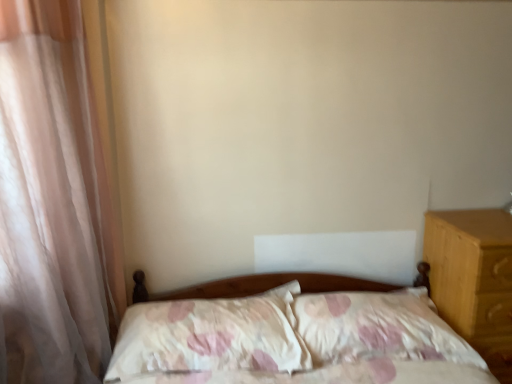
Question: Which direction should I rotate to look at fluffy white pillow at center, which is the 1th pillow in left-to-right order?

Choices:
 (A) right
 (B) left

Answer: (B)

Question: Could you tell me if light brown wood at right is turned towards fluffy white pillow at center, which ranks as the second pillow in right-to-left order?

Choices:
 (A) yes
 (B) no

Answer: (B)

Question: Considering the relative positions of light brown wood at right and fluffy white pillow at center, which is the 1th pillow in left-to-right order, in the image provided, is light brown wood at right to the right of fluffy white pillow at center, which is the 1th pillow in left-to-right order, from the viewer's perspective?

Choices:
 (A) yes
 (B) no

Answer: (A)

Question: Does light brown wood at right have a greater width compared to fluffy white pillow at center, which ranks as the second pillow in right-to-left order?

Choices:
 (A) no
 (B) yes

Answer: (B)

Question: From a real-world perspective, does light brown wood at right stand above fluffy white pillow at center, which is the 1th pillow in left-to-right order?

Choices:
 (A) no
 (B) yes

Answer: (A)

Question: From a real-world perspective, is light brown wood at right physically below fluffy white pillow at center, which ranks as the second pillow in right-to-left order?

Choices:
 (A) yes
 (B) no

Answer: (A)

Question: From the image's perspective, would you say light brown wood at right is shown under fluffy white pillow at center, which ranks as the second pillow in right-to-left order?

Choices:
 (A) yes
 (B) no

Answer: (A)

Question: Is fluffy white pillow at center, which ranks as the second pillow in right-to-left order, to the left of sheer white curtain at left from the viewer's perspective?

Choices:
 (A) no
 (B) yes

Answer: (A)

Question: Does fluffy white pillow at center, which is the 1th pillow in left-to-right order, appear on the right side of sheer white curtain at left?

Choices:
 (A) yes
 (B) no

Answer: (A)

Question: Is fluffy white pillow at center, which is the 1th pillow in left-to-right order, not near sheer white curtain at left?

Choices:
 (A) yes
 (B) no

Answer: (B)

Question: From the image's perspective, is fluffy white pillow at center, which is the 1th pillow in left-to-right order, over sheer white curtain at left?

Choices:
 (A) yes
 (B) no

Answer: (B)

Question: From a real-world perspective, is fluffy white pillow at center, which is the 1th pillow in left-to-right order, on sheer white curtain at left?

Choices:
 (A) no
 (B) yes

Answer: (A)

Question: Does fluffy white pillow at center, which ranks as the second pillow in right-to-left order, lie in front of sheer white curtain at left?

Choices:
 (A) yes
 (B) no

Answer: (B)

Question: Could you tell me if sheer white curtain at left is turned towards fluffy white pillow at center, placed as the 1th pillow when sorted from right to left?

Choices:
 (A) yes
 (B) no

Answer: (A)